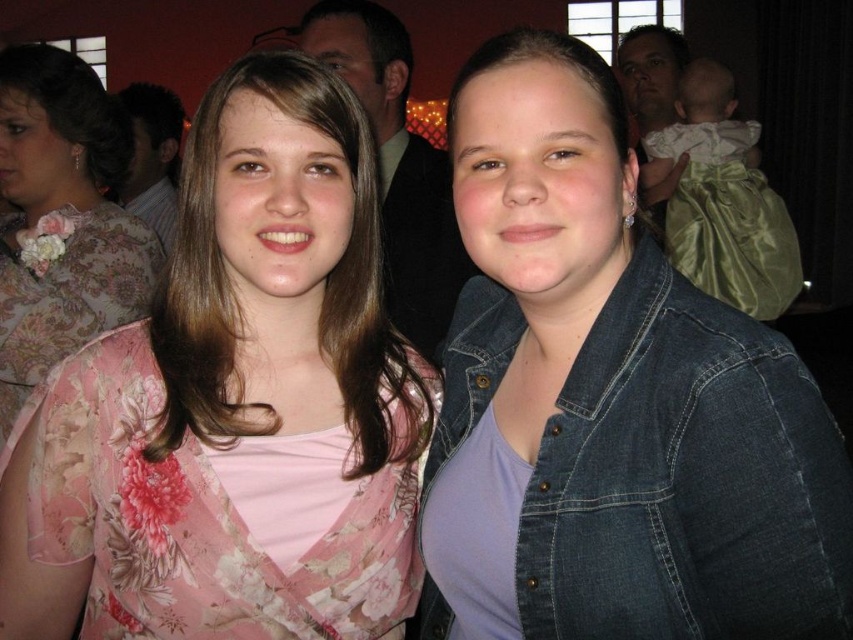
Is denim jacket at lower right shorter than floral lace dress at left?

Yes, denim jacket at lower right is shorter than floral lace dress at left.

Measure the distance between denim jacket at lower right and floral lace dress at left.

denim jacket at lower right is 1.90 meters away from floral lace dress at left.

Between point (621, 272) and point (55, 96), which one is positioned in front?

Point (621, 272) is more forward.

Where is `denim jacket at lower right`? The image size is (853, 640). denim jacket at lower right is located at coordinates (610, 401).

Is floral fabric dress at left wider than floral lace dress at left?

No, floral fabric dress at left is not wider than floral lace dress at left.

Who is more distant from viewer, (343, 387) or (15, 317)?

Positioned behind is point (15, 317).

This screenshot has height=640, width=853. Identify the location of floral fabric dress at left. (234, 404).

Is floral lace dress at left closer to the viewer compared to pink floral dress at center?

No.

Can you confirm if floral lace dress at left is shorter than pink floral dress at center?

No, floral lace dress at left is not shorter than pink floral dress at center.

Does point (18, 122) come behind point (315, 6)?

No, it is not.

Locate an element on the screen. The image size is (853, 640). floral lace dress at left is located at coordinates (62, 218).